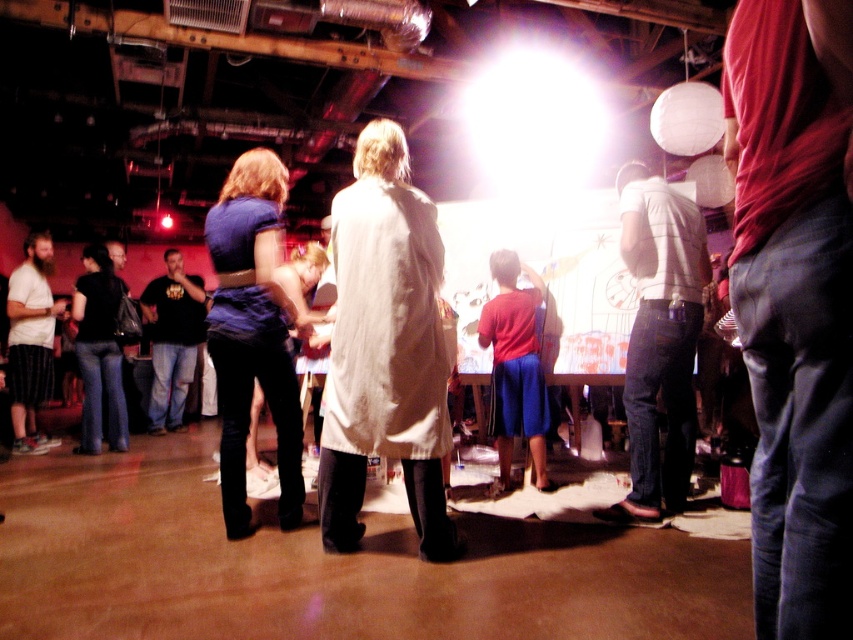
Does red cotton shirt at right have a smaller size compared to white cotton coat at center?

Yes.

This screenshot has width=853, height=640. Identify the location of red cotton shirt at right. (793, 304).

Who is shorter, white cotton coat at center or black cotton shirt at left?

With less height is black cotton shirt at left.

Does white cotton coat at center appear on the right side of black cotton shirt at left?

Yes, white cotton coat at center is to the right of black cotton shirt at left.

Image resolution: width=853 pixels, height=640 pixels. Describe the element at coordinates (386, 349) in the screenshot. I see `white cotton coat at center` at that location.

Locate an element on the screen. This screenshot has height=640, width=853. white cotton coat at center is located at coordinates (386, 349).

Can you confirm if white textured shirt at center is positioned to the right of black cotton shirt at left?

Correct, you'll find white textured shirt at center to the right of black cotton shirt at left.

Between point (648, 298) and point (164, 285), which one is positioned behind?

The point (164, 285) is behind.

At what (x,y) coordinates should I click in order to perform the action: click on white textured shirt at center. Please return your answer as a coordinate pair (x, y). Looking at the image, I should click on tap(659, 339).